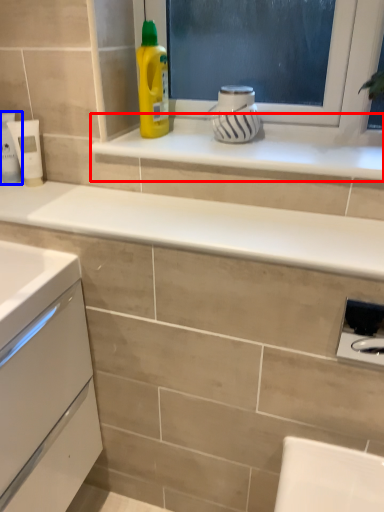
Question: Which of the following is the closest to the observer, window sill (highlighted by a red box) or toiletry (highlighted by a blue box)?

Choices:
 (A) window sill
 (B) toiletry

Answer: (A)